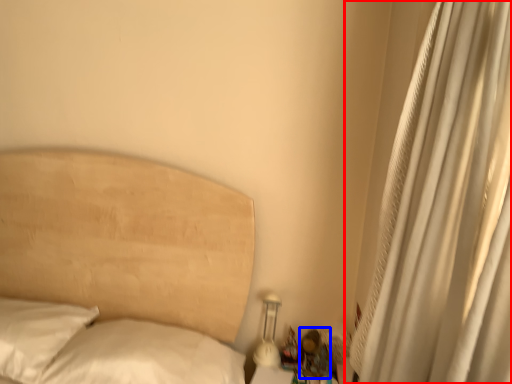
Question: Among these objects, which one is nearest to the camera, curtain (highlighted by a red box) or miniature (highlighted by a blue box)?

Choices:
 (A) curtain
 (B) miniature

Answer: (A)